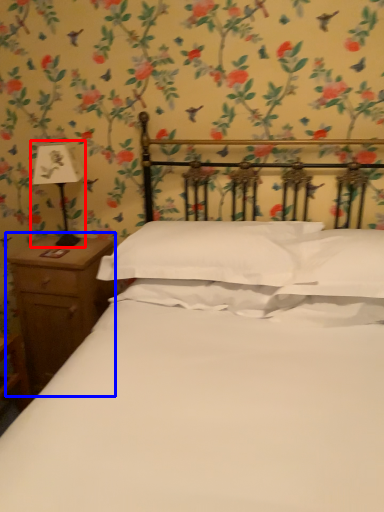
Question: Which of the following is the farthest to the observer, bedside lamp (highlighted by a red box) or nightstand (highlighted by a blue box)?

Choices:
 (A) bedside lamp
 (B) nightstand

Answer: (B)